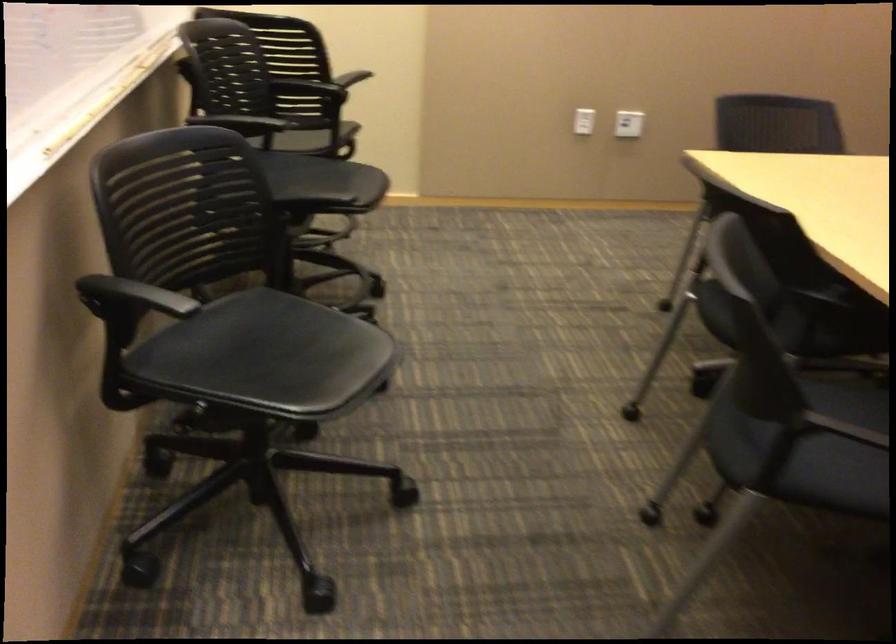
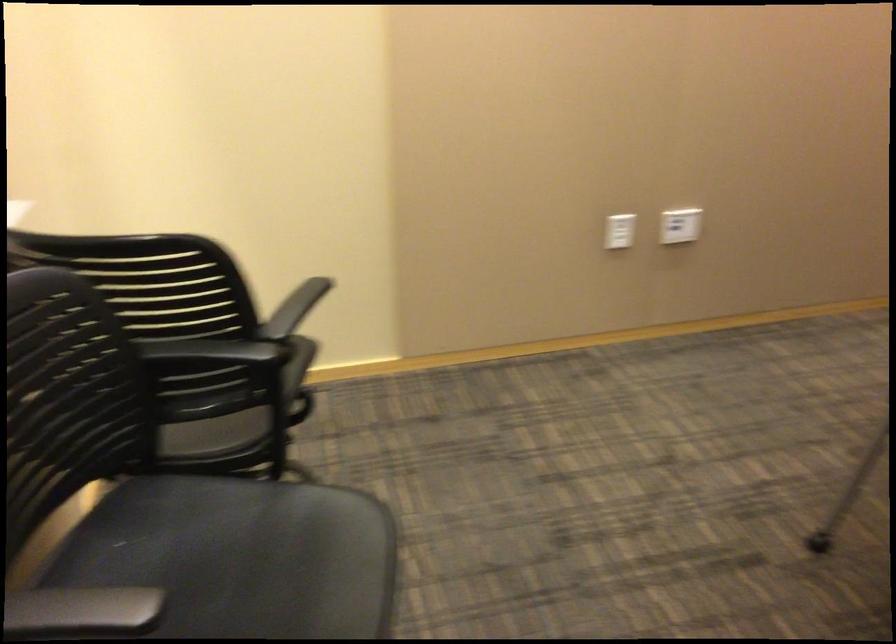
Question: What movement of the cameraman would produce the second image?

Choices:
 (A) Left
 (B) Right
 (C) Forward
 (D) Backward

Answer: (C)